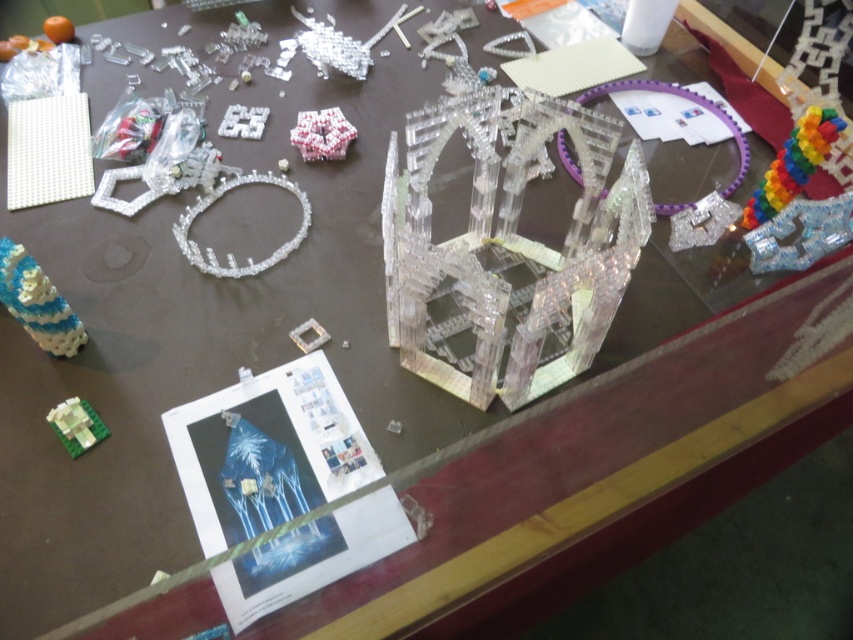
Question: Can you confirm if blue translucent beaded bracelet at lower left is thinner than translucent plastic cube at center?

Choices:
 (A) yes
 (B) no

Answer: (A)

Question: Is the position of translucent plastic rainbow cube at upper right less distant than that of clear plastic puzzle at upper center?

Choices:
 (A) yes
 (B) no

Answer: (A)

Question: Which of the following is the closest to the observer?

Choices:
 (A) (323, 336)
 (B) (71, 426)

Answer: (B)

Question: Which point is farther from the camera taking this photo?

Choices:
 (A) (76, 444)
 (B) (341, 140)
 (C) (492, 182)

Answer: (B)

Question: Among these points, which one is nearest to the camera?

Choices:
 (A) (88, 420)
 (B) (235, 116)
 (C) (675, 212)
 (D) (767, 189)

Answer: (A)

Question: Is green matte block at lower left positioned at the back of clear plastic square at center?

Choices:
 (A) yes
 (B) no

Answer: (B)